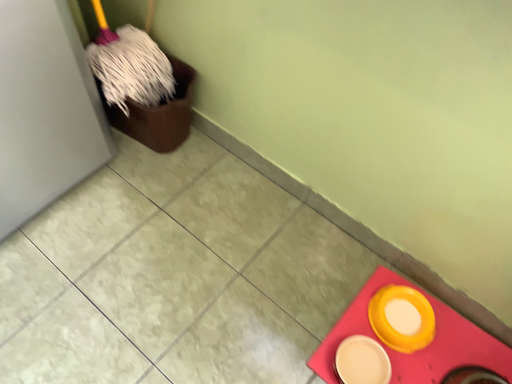
Question: Is yellow matte bowl at lower right, the 2th tableware from the left, to the left of matte yellow plate at lower right, marked as the 1th tableware in a left-to-right arrangement, from the viewer's perspective?

Choices:
 (A) no
 (B) yes

Answer: (A)

Question: Considering the relative sizes of yellow matte bowl at lower right, the first tableware in the right-to-left sequence, and matte yellow plate at lower right, which ranks as the 2th tableware in right-to-left order, in the image provided, is yellow matte bowl at lower right, the first tableware in the right-to-left sequence, shorter than matte yellow plate at lower right, which ranks as the 2th tableware in right-to-left order,?

Choices:
 (A) no
 (B) yes

Answer: (A)

Question: Is yellow matte bowl at lower right, the first tableware in the right-to-left sequence, positioned with its back to matte yellow plate at lower right, which ranks as the 2th tableware in right-to-left order?

Choices:
 (A) yes
 (B) no

Answer: (B)

Question: From the image's perspective, would you say yellow matte bowl at lower right, the 2th tableware from the left, is positioned over matte yellow plate at lower right, which ranks as the 2th tableware in right-to-left order?

Choices:
 (A) yes
 (B) no

Answer: (A)

Question: Does yellow matte bowl at lower right, the 2th tableware from the left, lie behind matte yellow plate at lower right, marked as the 1th tableware in a left-to-right arrangement?

Choices:
 (A) yes
 (B) no

Answer: (A)

Question: In terms of height, does matte yellow bowl at lower right look taller or shorter compared to matte yellow plate at lower right, marked as the 1th tableware in a left-to-right arrangement?

Choices:
 (A) short
 (B) tall

Answer: (A)

Question: Is matte yellow bowl at lower right bigger or smaller than matte yellow plate at lower right, marked as the 1th tableware in a left-to-right arrangement?

Choices:
 (A) small
 (B) big

Answer: (B)

Question: Considering the positions of point (343, 326) and point (368, 344), is point (343, 326) closer or farther from the camera than point (368, 344)?

Choices:
 (A) closer
 (B) farther

Answer: (B)

Question: Considering the relative positions of matte yellow bowl at lower right and matte yellow plate at lower right, which ranks as the 2th tableware in right-to-left order, in the image provided, is matte yellow bowl at lower right to the left or to the right of matte yellow plate at lower right, which ranks as the 2th tableware in right-to-left order,?

Choices:
 (A) left
 (B) right

Answer: (B)

Question: Is matte yellow plate at lower right, marked as the 1th tableware in a left-to-right arrangement, situated inside yellow matte bowl at lower right, the 2th tableware from the left, or outside?

Choices:
 (A) outside
 (B) inside

Answer: (A)

Question: Is point pos(352,355) positioned closer to the camera than point pos(434,317)?

Choices:
 (A) farther
 (B) closer

Answer: (B)

Question: Considering the positions of matte yellow plate at lower right, which ranks as the 2th tableware in right-to-left order, and yellow matte bowl at lower right, the first tableware in the right-to-left sequence, in the image, is matte yellow plate at lower right, which ranks as the 2th tableware in right-to-left order, bigger or smaller than yellow matte bowl at lower right, the first tableware in the right-to-left sequence,?

Choices:
 (A) small
 (B) big

Answer: (A)

Question: From their relative heights in the image, would you say matte yellow plate at lower right, which ranks as the 2th tableware in right-to-left order, is taller or shorter than yellow matte bowl at lower right, the first tableware in the right-to-left sequence?

Choices:
 (A) tall
 (B) short

Answer: (B)

Question: Is matte yellow plate at lower right, which ranks as the 2th tableware in right-to-left order, situated inside matte yellow bowl at lower right or outside?

Choices:
 (A) outside
 (B) inside

Answer: (A)

Question: In the image, is matte yellow plate at lower right, which ranks as the 2th tableware in right-to-left order, on the left side or the right side of matte yellow bowl at lower right?

Choices:
 (A) right
 (B) left

Answer: (B)